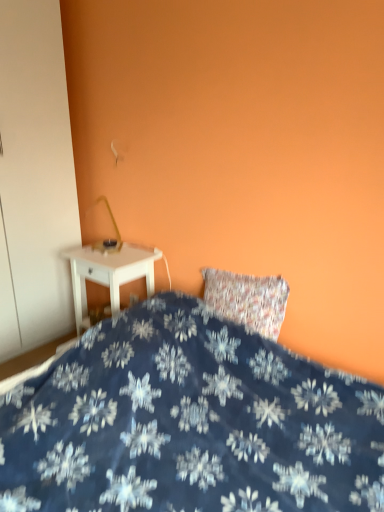
Question: Would you say white glossy nightstand at left is outside white plastic electric outlet at lower center?

Choices:
 (A) no
 (B) yes

Answer: (B)

Question: Is white glossy nightstand at left to the left of white plastic electric outlet at lower center from the viewer's perspective?

Choices:
 (A) no
 (B) yes

Answer: (B)

Question: Is white glossy nightstand at left thinner than white plastic electric outlet at lower center?

Choices:
 (A) yes
 (B) no

Answer: (B)

Question: Considering the relative sizes of white glossy nightstand at left and white plastic electric outlet at lower center in the image provided, is white glossy nightstand at left wider than white plastic electric outlet at lower center?

Choices:
 (A) no
 (B) yes

Answer: (B)

Question: Is white glossy nightstand at left further to the viewer compared to white plastic electric outlet at lower center?

Choices:
 (A) no
 (B) yes

Answer: (A)

Question: Is blue fabric bed at lower center in front of or behind white matte armoire at left in the image?

Choices:
 (A) behind
 (B) front

Answer: (B)

Question: Is point (173, 307) closer or farther from the camera than point (19, 198)?

Choices:
 (A) farther
 (B) closer

Answer: (B)

Question: From a real-world perspective, is blue fabric bed at lower center physically located above or below white matte armoire at left?

Choices:
 (A) above
 (B) below

Answer: (B)

Question: In the image, is blue fabric bed at lower center on the left side or the right side of white matte armoire at left?

Choices:
 (A) right
 (B) left

Answer: (A)

Question: Is blue fabric bed at lower center wider or thinner than white glossy nightstand at left?

Choices:
 (A) thin
 (B) wide

Answer: (B)

Question: Is blue fabric bed at lower center in front of or behind white glossy nightstand at left in the image?

Choices:
 (A) behind
 (B) front

Answer: (B)

Question: Is blue fabric bed at lower center bigger or smaller than white glossy nightstand at left?

Choices:
 (A) small
 (B) big

Answer: (B)

Question: From the image's perspective, is blue fabric bed at lower center positioned above or below white glossy nightstand at left?

Choices:
 (A) below
 (B) above

Answer: (A)

Question: From a real-world perspective, relative to white plastic electric outlet at lower center, is white matte armoire at left vertically above or below?

Choices:
 (A) below
 (B) above

Answer: (B)

Question: Looking at their shapes, would you say white matte armoire at left is wider or thinner than white plastic electric outlet at lower center?

Choices:
 (A) wide
 (B) thin

Answer: (A)